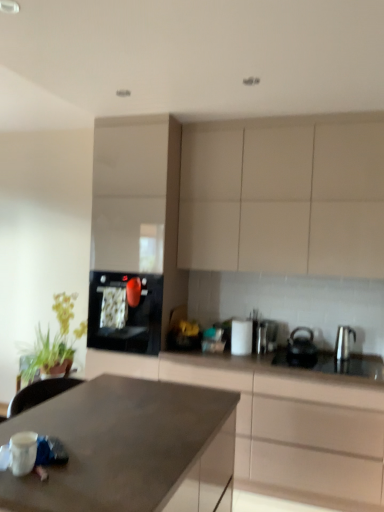
Measure the distance between point (343,329) and camera.

Point (343,329) and camera are 3.16 meters apart.

How much space does white glossy cabinet at center, marked as the third cabinetry in a front-to-back arrangement, occupy vertically?

The height of white glossy cabinet at center, marked as the third cabinetry in a front-to-back arrangement, is 6.94 feet.

This screenshot has width=384, height=512. Describe the element at coordinates (284, 196) in the screenshot. I see `white matte cabinet at upper center, placed as the second cabinetry when sorted from back to front` at that location.

The height and width of the screenshot is (512, 384). Find the location of `black matte kettle at right, which appears as the 2th kitchen appliance when viewed from the left`. black matte kettle at right, which appears as the 2th kitchen appliance when viewed from the left is located at coordinates (301, 349).

In order to face black matte kettle at right, the 2th kitchen appliance from the right, should I rotate leftwards or rightwards?

To face it directly, rotate right by 14.499 degrees.

In order to face white glossy cup at upper center, placed as the second appliance when sorted from right to left, should I rotate leftwards or rightwards?

You should rotate right by 6.658 degrees.

Describe the element at coordinates (129, 448) in the screenshot. I see `matte gray countertop at center` at that location.

Locate an element on the screen. The height and width of the screenshot is (512, 384). satin metallic toaster at center, which is counted as the 1th appliance, starting from the right is located at coordinates (266, 336).

Find the location of `satin silver kettle at right, placed as the 3th kitchen appliance when sorted from left to right`. satin silver kettle at right, placed as the 3th kitchen appliance when sorted from left to right is located at coordinates (343, 342).

The image size is (384, 512). Identify the location of kitchen appliance that is the 2nd object located above the green leafy plant at left (from the image's perspective). (343, 342).

From the image's perspective, relative to green leafy plant at left, is satin silver kettle at right, marked as the first kitchen appliance in a right-to-left arrangement, above or below?

satin silver kettle at right, marked as the first kitchen appliance in a right-to-left arrangement, is situated higher than green leafy plant at left in the image.

Consider the image. Could you tell me if satin silver kettle at right, marked as the first kitchen appliance in a right-to-left arrangement, is facing green leafy plant at left?

No, satin silver kettle at right, marked as the first kitchen appliance in a right-to-left arrangement, is not turned towards green leafy plant at left.

Between point (336, 353) and point (49, 344), which one is positioned in front?

The point (336, 353) is in front.

Which is farther from the camera, (94, 201) or (315, 346)?

The point (315, 346) is farther.

Considering the sizes of objects white glossy cabinet at center, the first cabinetry when ordered from back to front, and black matte kettle at right, the 2th kitchen appliance from the right, in the image provided, who is wider, white glossy cabinet at center, the first cabinetry when ordered from back to front, or black matte kettle at right, the 2th kitchen appliance from the right,?

white glossy cabinet at center, the first cabinetry when ordered from back to front.

Between white glossy cabinet at center, the first cabinetry when ordered from back to front, and black matte kettle at right, the 2th kitchen appliance from the right, which one appears on the right side from the viewer's perspective?

black matte kettle at right, the 2th kitchen appliance from the right, is more to the right.

Is white glossy cabinet at center, the first cabinetry when ordered from back to front, bigger than black matte kettle at right, which appears as the 2th kitchen appliance when viewed from the left?

Yes, white glossy cabinet at center, the first cabinetry when ordered from back to front, is bigger than black matte kettle at right, which appears as the 2th kitchen appliance when viewed from the left.

From their relative heights in the image, would you say matte gray countertop at center is taller or shorter than satin metallic toaster at center, which is counted as the 1th appliance, starting from the right?

In the image, matte gray countertop at center appears to be taller than satin metallic toaster at center, which is counted as the 1th appliance, starting from the right.

Is matte gray countertop at center wider than satin metallic toaster at center, which ranks as the 2th appliance in left-to-right order?

Yes.

Based on the photo, is matte gray countertop at center behind satin metallic toaster at center, which is counted as the 1th appliance, starting from the right?

No, it is not.

From a real-world perspective, is matte gray countertop at center positioned under satin metallic toaster at center, which is counted as the 1th appliance, starting from the right, based on gravity?

Yes, from a real-world perspective, matte gray countertop at center is under satin metallic toaster at center, which is counted as the 1th appliance, starting from the right.

Which point is more forward, (58, 346) or (349, 339)?

The point (349, 339) is in front.

Between green leafy plant at left and satin silver kettle at right, placed as the 3th kitchen appliance when sorted from left to right, which one has less height?

Standing shorter between the two is satin silver kettle at right, placed as the 3th kitchen appliance when sorted from left to right.

Which is behind, green leafy plant at left or satin silver kettle at right, marked as the first kitchen appliance in a right-to-left arrangement?

green leafy plant at left is further from the camera.

Identify the location of countertop located in front of the white glossy cup at upper center, which appears as the first appliance when viewed from the left. click(x=129, y=448).

Who is taller, white glossy cup at upper center, which appears as the first appliance when viewed from the left, or matte gray countertop at center?

matte gray countertop at center.

Is the surface of white glossy cup at upper center, which appears as the first appliance when viewed from the left, in direct contact with matte gray countertop at center?

No, white glossy cup at upper center, which appears as the first appliance when viewed from the left, is not touching matte gray countertop at center.

From the image's perspective, which one is positioned lower, green leafy plant at left or black glossy oven at center, the 3th kitchen appliance from the right?

green leafy plant at left, from the image's perspective.

Between green leafy plant at left and black glossy oven at center, the 3th kitchen appliance from the right, which one has more height?

black glossy oven at center, the 3th kitchen appliance from the right, is taller.

Would you say green leafy plant at left is outside black glossy oven at center, the first kitchen appliance positioned from the left?

Yes, green leafy plant at left is located beyond the bounds of black glossy oven at center, the first kitchen appliance positioned from the left.

Which object is positioned more to the right, satin metallic toaster at center, which ranks as the 2th appliance in left-to-right order, or satin silver kettle at right, marked as the first kitchen appliance in a right-to-left arrangement?

satin silver kettle at right, marked as the first kitchen appliance in a right-to-left arrangement.

Is point (269, 347) less distant than point (345, 351)?

No, it is not.

Can we say satin metallic toaster at center, which is counted as the 1th appliance, starting from the right, lies outside satin silver kettle at right, placed as the 3th kitchen appliance when sorted from left to right?

Yes, satin metallic toaster at center, which is counted as the 1th appliance, starting from the right, is outside of satin silver kettle at right, placed as the 3th kitchen appliance when sorted from left to right.

From a real-world perspective, between satin metallic toaster at center, which ranks as the 2th appliance in left-to-right order, and satin silver kettle at right, marked as the first kitchen appliance in a right-to-left arrangement, who is vertically lower?

satin metallic toaster at center, which ranks as the 2th appliance in left-to-right order, from a real-world perspective.

The image size is (384, 512). I want to click on plant that appears below the satin silver kettle at right, marked as the first kitchen appliance in a right-to-left arrangement (from a real-world perspective), so click(54, 343).

At what (x,y) coordinates should I click in order to perform the action: click on the 2nd kitchen appliance in front of the white glossy cabinet at center, marked as the third cabinetry in a front-to-back arrangement, counting from the anchor's position. Please return your answer as a coordinate pair (x, y). Looking at the image, I should click on (x=301, y=349).

Which object lies nearer to the anchor point satin silver kettle at right, marked as the first kitchen appliance in a right-to-left arrangement, white glossy cup at upper center, placed as the second appliance when sorted from right to left, or black glossy oven at center, the first kitchen appliance positioned from the left?

Based on the image, white glossy cup at upper center, placed as the second appliance when sorted from right to left, appears to be nearer to satin silver kettle at right, marked as the first kitchen appliance in a right-to-left arrangement.

When comparing their distances from satin metallic toaster at center, which ranks as the 2th appliance in left-to-right order, does matte gray countertop at center or matte brown cabinet at center, the first cabinetry positioned from the front, seem closer?

matte brown cabinet at center, the first cabinetry positioned from the front.

When comparing their distances from matte gray countertop at center, does satin silver kettle at right, marked as the first kitchen appliance in a right-to-left arrangement, or satin metallic toaster at center, which ranks as the 2th appliance in left-to-right order, seem further?

satin silver kettle at right, marked as the first kitchen appliance in a right-to-left arrangement.

When comparing their distances from matte brown cabinet at center, the third cabinetry from the back, does white matte cabinet at upper center, the 2th cabinetry viewed from the front, or satin silver kettle at right, placed as the 3th kitchen appliance when sorted from left to right, seem closer?

satin silver kettle at right, placed as the 3th kitchen appliance when sorted from left to right, lies closer to matte brown cabinet at center, the third cabinetry from the back, than the other object.

Estimate the real-world distances between objects in this image. Which object is closer to white matte cabinet at upper center, the 2th cabinetry viewed from the front, white glossy cabinet at center, marked as the third cabinetry in a front-to-back arrangement, or black glossy oven at center, the 3th kitchen appliance from the right?

Among the two, white glossy cabinet at center, marked as the third cabinetry in a front-to-back arrangement, is located nearer to white matte cabinet at upper center, the 2th cabinetry viewed from the front.

Considering their positions, is green leafy plant at left positioned further to black glossy oven at center, the 3th kitchen appliance from the right, than white glossy cabinet at center, marked as the third cabinetry in a front-to-back arrangement?

green leafy plant at left.

When comparing their distances from satin metallic toaster at center, which is counted as the 1th appliance, starting from the right, does green leafy plant at left or matte gray countertop at center seem further?

green leafy plant at left lies further to satin metallic toaster at center, which is counted as the 1th appliance, starting from the right, than the other object.

Estimate the real-world distances between objects in this image. Which object is further from white glossy cabinet at center, marked as the third cabinetry in a front-to-back arrangement, white matte cabinet at upper center, placed as the second cabinetry when sorted from back to front, or matte brown cabinet at center, the first cabinetry positioned from the front?

Based on the image, matte brown cabinet at center, the first cabinetry positioned from the front, appears to be further to white glossy cabinet at center, marked as the third cabinetry in a front-to-back arrangement.

This screenshot has width=384, height=512. Find the location of `plant between matte gray countertop at center and satin metallic toaster at center, which ranks as the 2th appliance in left-to-right order, from front to back`. plant between matte gray countertop at center and satin metallic toaster at center, which ranks as the 2th appliance in left-to-right order, from front to back is located at coordinates (54, 343).

Image resolution: width=384 pixels, height=512 pixels. I want to click on plant between matte brown cabinet at center, the third cabinetry from the back, and satin metallic toaster at center, which ranks as the 2th appliance in left-to-right order, from front to back, so click(x=54, y=343).

At what (x,y) coordinates should I click in order to perform the action: click on kitchen appliance situated between green leafy plant at left and satin metallic toaster at center, which is counted as the 1th appliance, starting from the right, from left to right. Please return your answer as a coordinate pair (x, y). The image size is (384, 512). Looking at the image, I should click on (124, 313).

What are the coordinates of `kitchen appliance situated between black glossy oven at center, the first kitchen appliance positioned from the left, and satin silver kettle at right, placed as the 3th kitchen appliance when sorted from left to right, from left to right` in the screenshot? It's located at (301, 349).